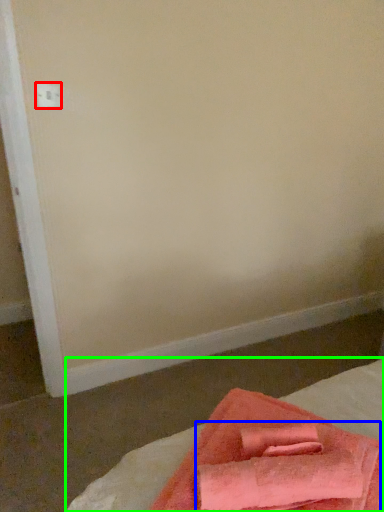
Question: Estimate the real-world distances between objects in this image. Which object is farther from electric outlet (highlighted by a red box), bath towel (highlighted by a blue box) or bed (highlighted by a green box)?

Choices:
 (A) bath towel
 (B) bed

Answer: (A)